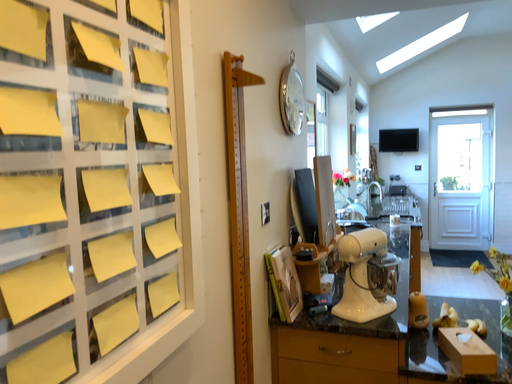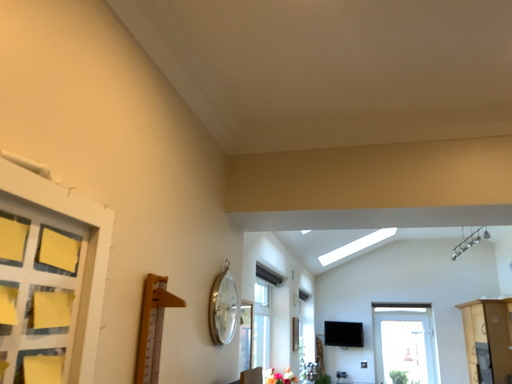
Question: Which way did the camera rotate in the video?

Choices:
 (A) rotated upward
 (B) rotated downward

Answer: (A)